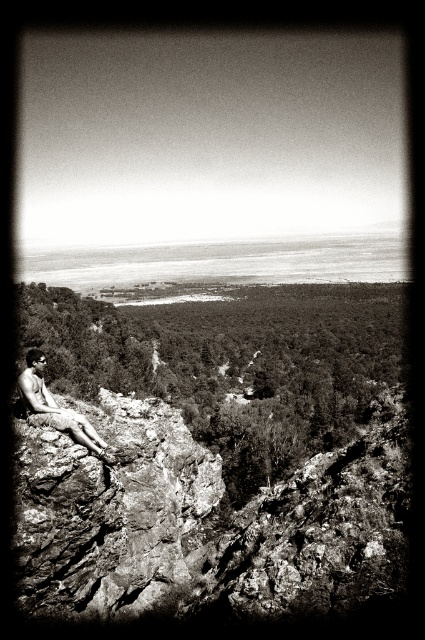
Question: Does rough textured rock at left have a larger size compared to shiny skin man at lower left?

Choices:
 (A) yes
 (B) no

Answer: (B)

Question: Which object is closer to the camera taking this photo?

Choices:
 (A) rough textured rock at left
 (B) shiny skin man at lower left

Answer: (A)

Question: Can you confirm if rough textured rock at left is positioned to the left of shiny skin man at lower left?

Choices:
 (A) yes
 (B) no

Answer: (B)

Question: Is rough textured rock at left to the left of shiny skin man at lower left from the viewer's perspective?

Choices:
 (A) yes
 (B) no

Answer: (B)